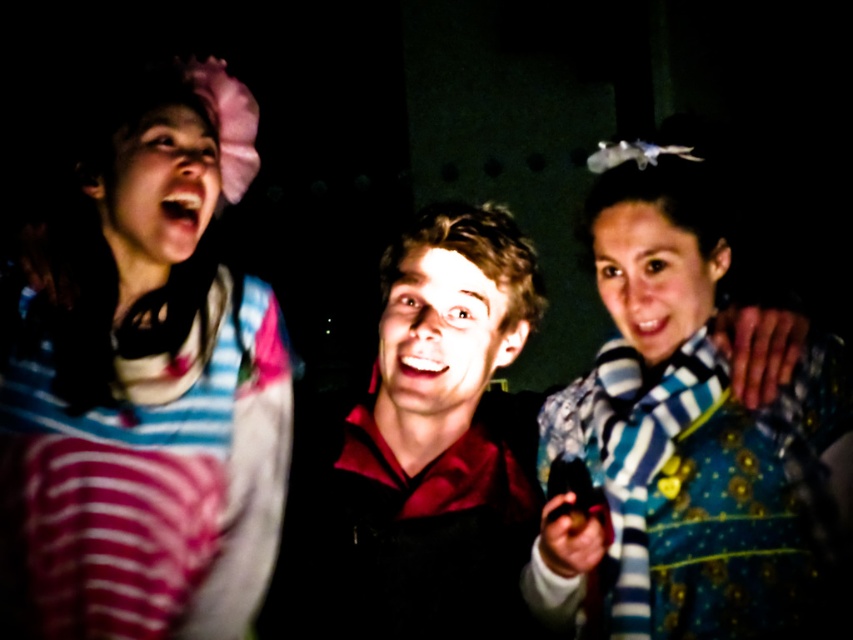
Does point (186, 337) come in front of point (625, 333)?

That is False.

Consider the image. Can you confirm if pink striped shirt at upper left is bigger than smooth blue scarf at center?

Yes.

The image size is (853, 640). What are the coordinates of `pink striped shirt at upper left` in the screenshot? It's located at (143, 385).

At what (x,y) coordinates should I click in order to perform the action: click on pink striped shirt at upper left. Please return your answer as a coordinate pair (x, y). This screenshot has width=853, height=640. Looking at the image, I should click on (143, 385).

Is point (500, 216) closer to viewer compared to point (376, 406)?

Yes, it is in front of point (376, 406).

Does matte red shirt at center appear on the left side of smooth skin face at center?

Yes, matte red shirt at center is to the left of smooth skin face at center.

Locate an element on the screen. The height and width of the screenshot is (640, 853). matte red shirt at center is located at coordinates (421, 464).

Is pink striped shirt at upper left thinner than blue striped scarf at center?

Yes, pink striped shirt at upper left is thinner than blue striped scarf at center.

Does point (152, 625) come closer to viewer compared to point (666, 394)?

That is True.

Is point (137, 372) positioned in front of point (666, 412)?

That is False.

Where is `pink striped shirt at upper left`? The image size is (853, 640). pink striped shirt at upper left is located at coordinates (143, 385).